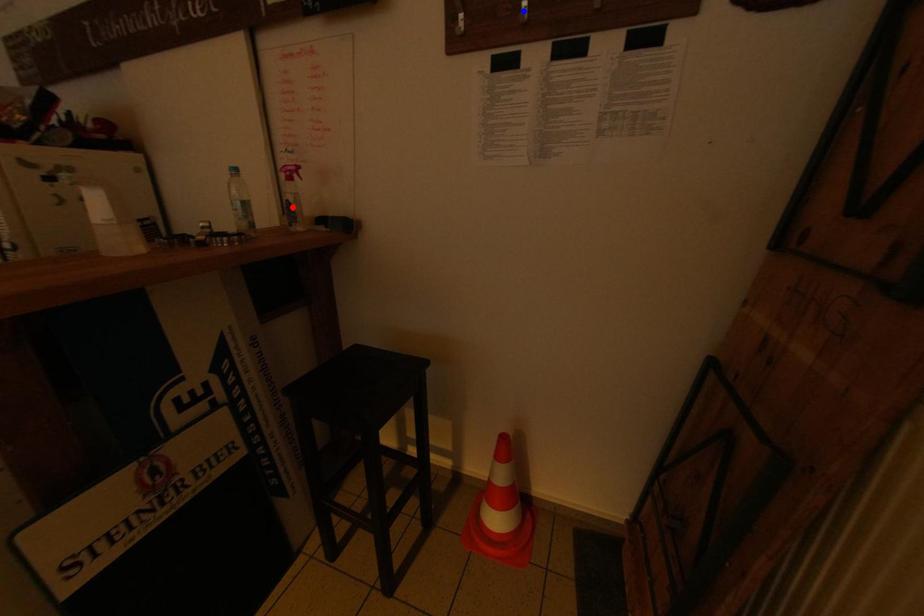
Question: In the image, two points are highlighted. Which point is nearer to the camera? Reply with the corresponding letter.

Choices:
 (A) blue point
 (B) red point

Answer: (A)